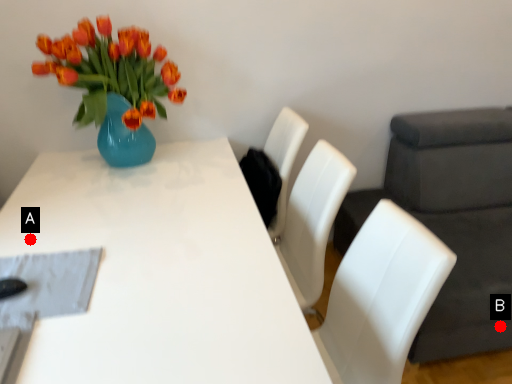
Question: Two points are circled on the image, labeled by A and B beside each circle. Among these points, which one is nearest to the camera?

Choices:
 (A) A is closer
 (B) B is closer

Answer: (A)